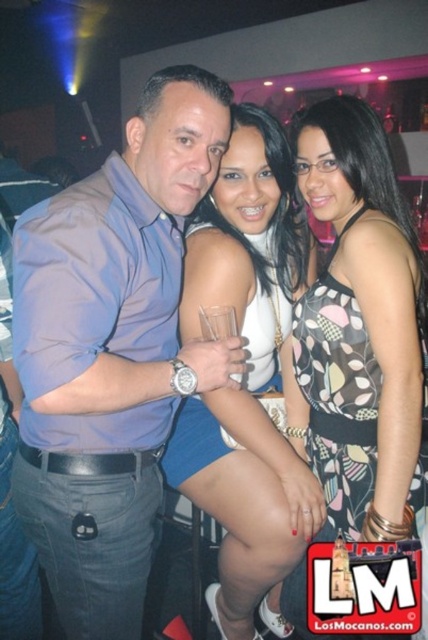
Between printed fabric dress at center and matte white tank top at center, which one appears on the right side from the viewer's perspective?

Positioned to the right is printed fabric dress at center.

Looking at this image, who is more forward, (315, 163) or (264, 586)?

Point (315, 163) is in front.

Image resolution: width=428 pixels, height=640 pixels. I want to click on printed fabric dress at center, so click(x=362, y=330).

Does matte blue shirt at center have a lesser height compared to printed fabric dress at center?

Indeed, matte blue shirt at center has a lesser height compared to printed fabric dress at center.

Based on the photo, is the position of matte blue shirt at center more distant than that of printed fabric dress at center?

That is False.

Is point (101, 192) behind point (315, 420)?

No, it is in front of (315, 420).

This screenshot has height=640, width=428. In order to click on matte blue shirt at center in this screenshot , I will do `click(112, 352)`.

Can you confirm if matte blue shirt at center is shorter than matte white tank top at center?

Indeed, matte blue shirt at center has a lesser height compared to matte white tank top at center.

Is matte blue shirt at center behind matte white tank top at center?

No, it is not.

You are a GUI agent. You are given a task and a screenshot of the screen. Output one action in this format:
    pyautogui.click(x=<x>, y=<y>)
    Task: Click on the matte blue shirt at center
    
    Given the screenshot: What is the action you would take?
    pyautogui.click(x=112, y=352)